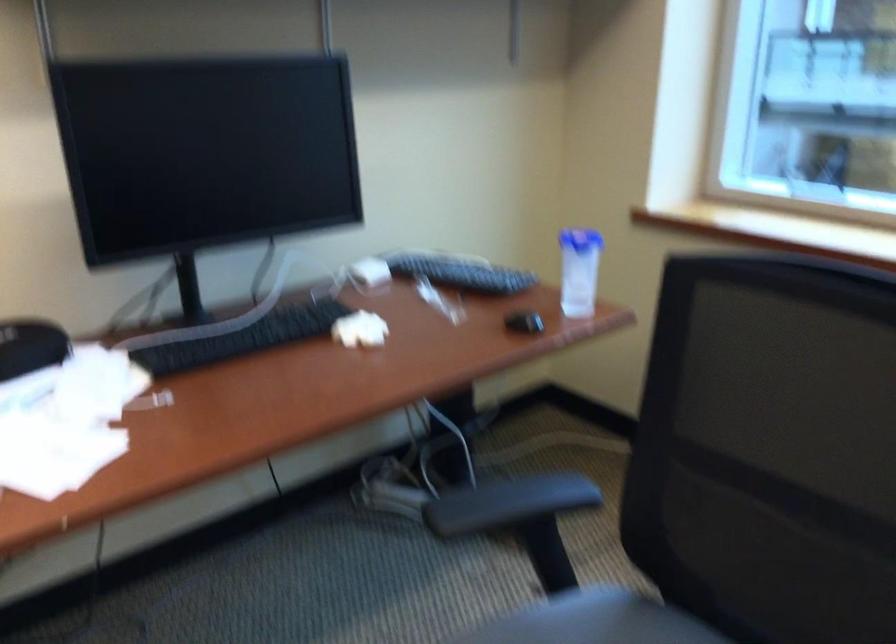
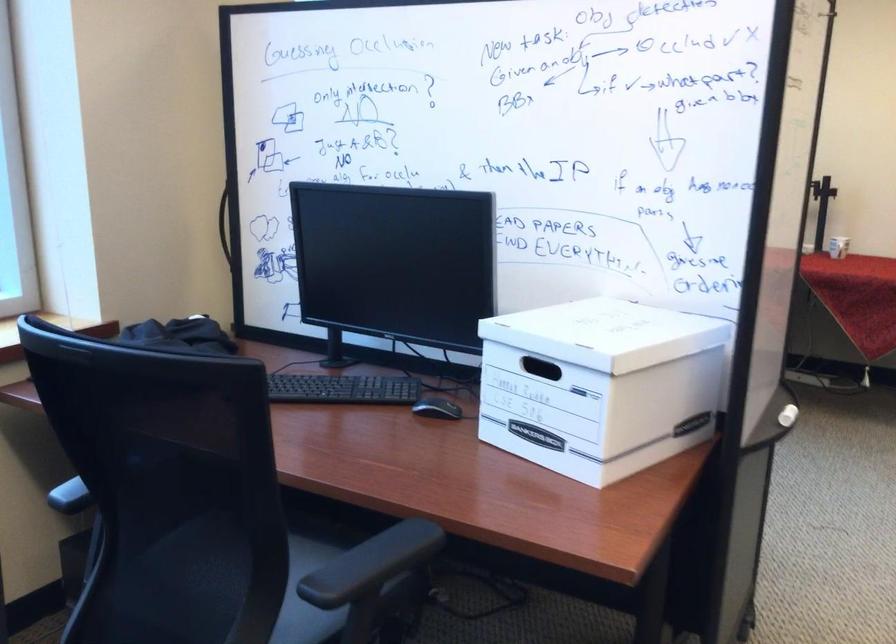
Based on the continuous images, in which direction is the camera rotating?

The camera rotated toward right-down.